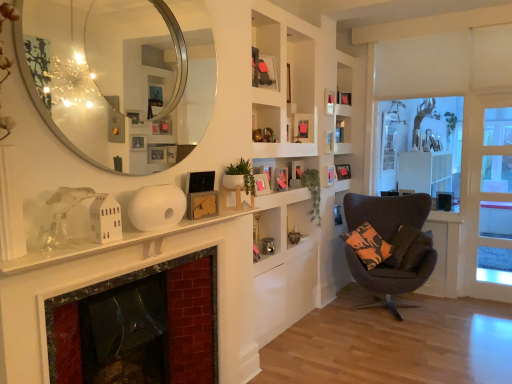
Question: Which direction should I rotate to look at green matte plant at center, marked as the 1th plant in a left-to-right arrangement, — up or down?

Choices:
 (A) down
 (B) up

Answer: (B)

Question: Are green matte plant at center, the second plant from the back, and white matte cabinet at upper center located far from each other?

Choices:
 (A) yes
 (B) no

Answer: (A)

Question: Considering the relative sizes of green matte plant at center, the second plant from the back, and white matte cabinet at upper center in the image provided, is green matte plant at center, the second plant from the back, bigger than white matte cabinet at upper center?

Choices:
 (A) yes
 (B) no

Answer: (B)

Question: From the image's perspective, is green matte plant at center, the second plant from the back, over white matte cabinet at upper center?

Choices:
 (A) yes
 (B) no

Answer: (B)

Question: Is green matte plant at center, marked as the 1th plant in a left-to-right arrangement, surrounding white matte cabinet at upper center?

Choices:
 (A) no
 (B) yes

Answer: (A)

Question: Can you confirm if green matte plant at center, marked as the 1th plant in a left-to-right arrangement, is wider than white matte cabinet at upper center?

Choices:
 (A) yes
 (B) no

Answer: (B)

Question: From the image's perspective, is green matte plant at center, the second plant from the back, located beneath white matte cabinet at upper center?

Choices:
 (A) no
 (B) yes

Answer: (B)

Question: Is the surface of green matte plant at center, which appears as the 1th plant when viewed from the front, in direct contact with wooden picture frame at center, the 2th picture frame when ordered from front to back?

Choices:
 (A) yes
 (B) no

Answer: (B)

Question: From the image's perspective, is green matte plant at center, marked as the 1th plant in a left-to-right arrangement, below wooden picture frame at center, the 8th picture frame when ordered from back to front?

Choices:
 (A) yes
 (B) no

Answer: (A)

Question: From the image's perspective, does green matte plant at center, the second plant from the back, appear higher than wooden picture frame at center, the 2th picture frame when ordered from front to back?

Choices:
 (A) yes
 (B) no

Answer: (B)

Question: From a real-world perspective, is green matte plant at center, the 2th plant positioned from the right, under wooden picture frame at center, the 2th picture frame when ordered from front to back?

Choices:
 (A) yes
 (B) no

Answer: (B)

Question: Is wooden picture frame at center, the 8th picture frame when ordered from back to front, at the back of green matte plant at center, the 2th plant positioned from the right?

Choices:
 (A) yes
 (B) no

Answer: (B)

Question: Is green matte plant at center, which appears as the 1th plant when viewed from the front, to the right of wooden picture frame at center, the 8th picture frame when ordered from back to front, from the viewer's perspective?

Choices:
 (A) yes
 (B) no

Answer: (B)

Question: Does white matte fireplace mantle at center appear on the right side of wooden picture frame at upper center, the fourth picture frame viewed from the left?

Choices:
 (A) no
 (B) yes

Answer: (A)